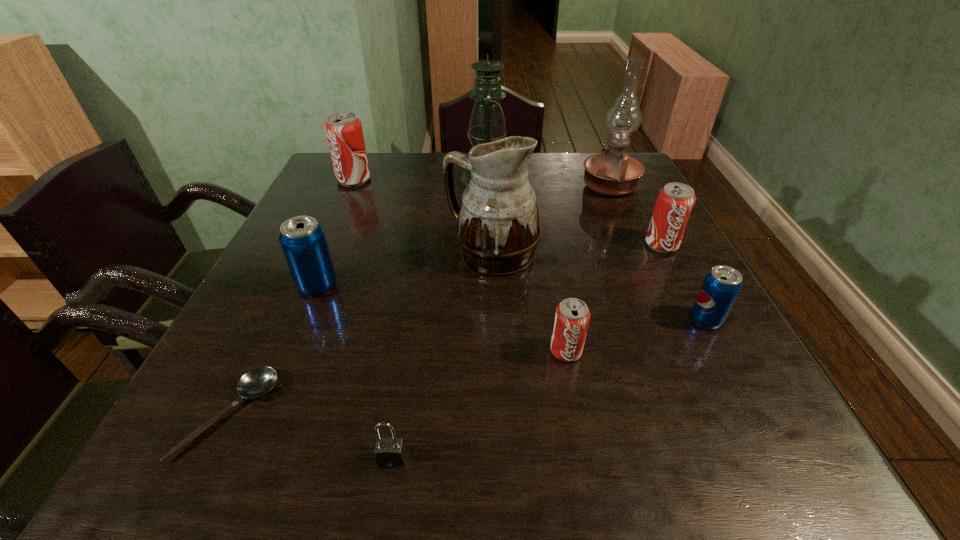
You are a GUI agent. You are given a task and a screenshot of the screen. Output one action in this format:
    pyautogui.click(x=<x>, y=<y>)
    Task: Click on the left oil lamp
    The height and width of the screenshot is (540, 960).
    Given the screenshot: What is the action you would take?
    pyautogui.click(x=487, y=124)

Where is `the right oil lamp`? This screenshot has height=540, width=960. the right oil lamp is located at coordinates (612, 173).

At what (x,y) coordinates should I click in order to perform the action: click on pitcher. Please return your answer as a coordinate pair (x, y). This screenshot has height=540, width=960. Looking at the image, I should click on (498, 230).

Where is `brown pitcher`? The height and width of the screenshot is (540, 960). brown pitcher is located at coordinates (498, 230).

Locate an element on the screen. The height and width of the screenshot is (540, 960). the farthest soda can is located at coordinates (344, 134).

At what (x,y) coordinates should I click in order to perform the action: click on the biggest pink soda can. Please return your answer as a coordinate pair (x, y). The image size is (960, 540). Looking at the image, I should click on (344, 134).

The image size is (960, 540). I want to click on the second nearest pink soda can, so point(675,201).

Find the location of a particular element. the second farthest soda can is located at coordinates (675, 201).

Find the location of `the left blue pop soda`. the left blue pop soda is located at coordinates (303, 241).

At what (x,y) coordinates should I click in order to perform the action: click on the farther blue pop soda. Please return your answer as a coordinate pair (x, y). Looking at the image, I should click on (303, 241).